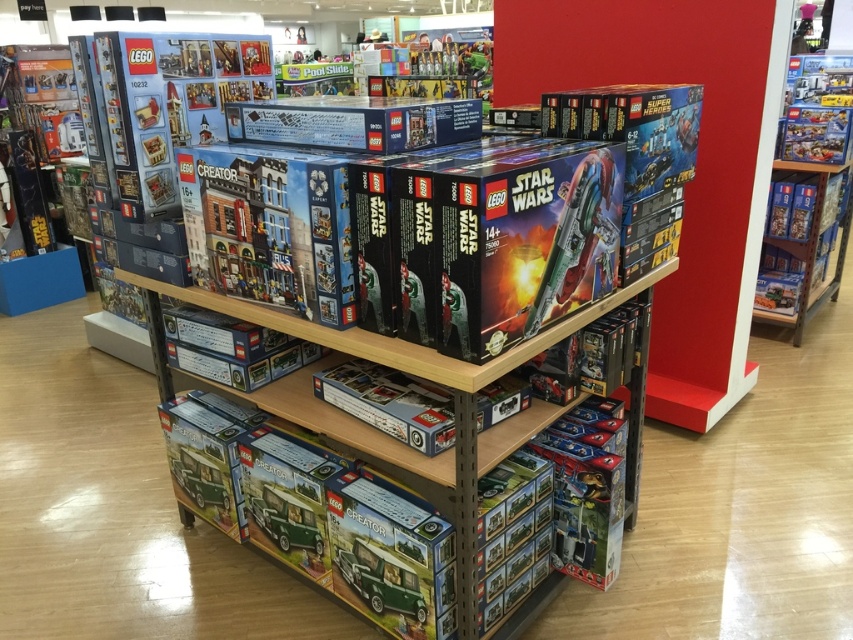
The width and height of the screenshot is (853, 640). What are the coordinates of `glossy plastic spaceship at center` in the screenshot? It's located at (573, 234).

Does glossy plastic spaceship at center come behind green matte van at lower center?

No.

Who is more distant from viewer, (579, 225) or (386, 595)?

Positioned behind is point (386, 595).

Where is `glossy plastic spaceship at center`? The height and width of the screenshot is (640, 853). glossy plastic spaceship at center is located at coordinates (573, 234).

Can you confirm if matte blue building at center is positioned to the right of glossy plastic spaceship at center?

Incorrect, matte blue building at center is not on the right side of glossy plastic spaceship at center.

Can you confirm if matte blue building at center is positioned to the left of glossy plastic spaceship at center?

Correct, you'll find matte blue building at center to the left of glossy plastic spaceship at center.

This screenshot has width=853, height=640. Describe the element at coordinates (248, 221) in the screenshot. I see `matte blue building at center` at that location.

This screenshot has height=640, width=853. Identify the location of matte blue building at center. (248, 221).

Does point (292, 209) come closer to viewer compared to point (408, 568)?

That is True.

Does matte blue building at center appear over green matte van at lower center?

Correct, matte blue building at center is located above green matte van at lower center.

The width and height of the screenshot is (853, 640). In order to click on matte blue building at center in this screenshot , I will do `click(248, 221)`.

This screenshot has width=853, height=640. Identify the location of matte blue building at center. (248, 221).